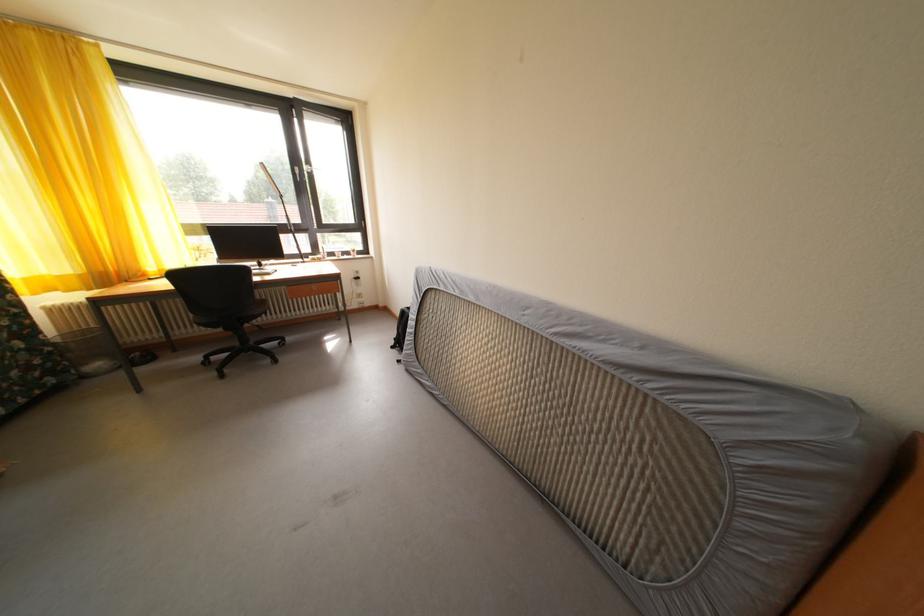
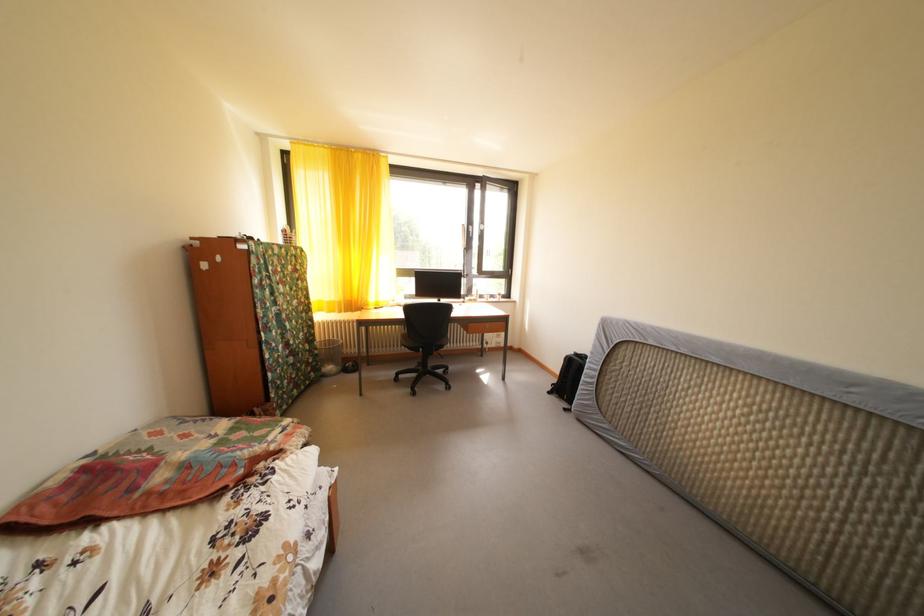
In the second image, find the point that corresponds to [402,349] in the first image.

(558, 394)